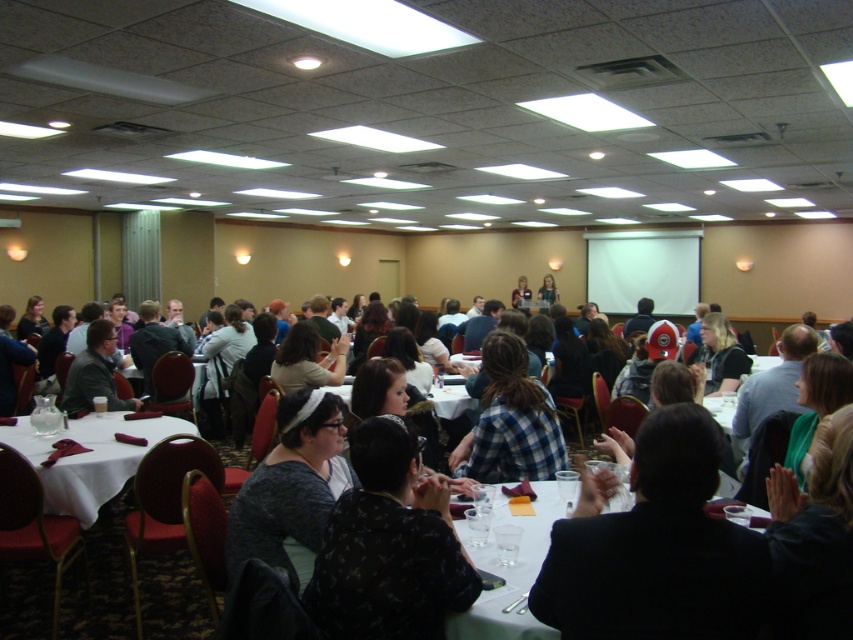
Who is more forward, (x=289, y=548) or (x=546, y=476)?

Point (x=289, y=548) is more forward.

Is point (293, 504) in front of point (469, 474)?

Yes, point (293, 504) is in front of point (469, 474).

Does point (311, 513) lie in front of point (480, 428)?

Yes, point (311, 513) is in front of point (480, 428).

Locate an element on the screen. The image size is (853, 640). dark gray textured sweater at center is located at coordinates (291, 490).

Which is more to the left, dark gray textured sweater at center or matte black jacket at center?

matte black jacket at center

Who is positioned more to the right, dark gray textured sweater at center or matte black jacket at center?

dark gray textured sweater at center is more to the right.

What do you see at coordinates (291, 490) in the screenshot? The height and width of the screenshot is (640, 853). I see `dark gray textured sweater at center` at bounding box center [291, 490].

This screenshot has width=853, height=640. In order to click on dark gray textured sweater at center in this screenshot , I will do `click(291, 490)`.

Between point (357, 442) and point (538, 429), which one is positioned behind?

The point (538, 429) is more distant.

Measure the distance between point (x=408, y=532) and camera.

1.74 meters

Which is behind, point (415, 499) or point (491, 449)?

The point (491, 449) is behind.

The height and width of the screenshot is (640, 853). What are the coordinates of `dark gray fabric shirt at center` in the screenshot? It's located at (389, 547).